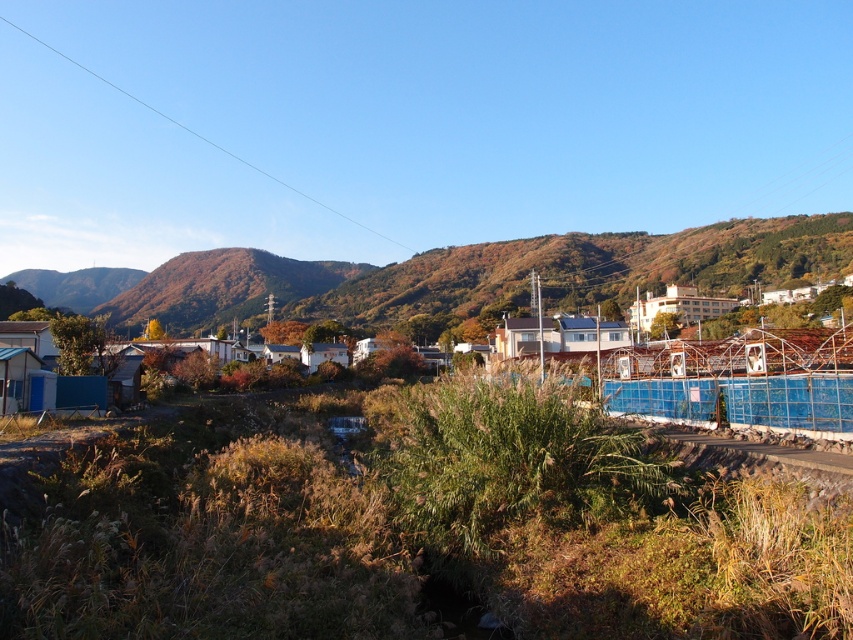
You are standing at the point labeled as point (415, 525) in the image. Looking around, you see a blue plastic amusement park at center. What is the nearest object to you?

The nearest object to you is the blue plastic amusement park at center because the point (415, 525) corresponds to it.